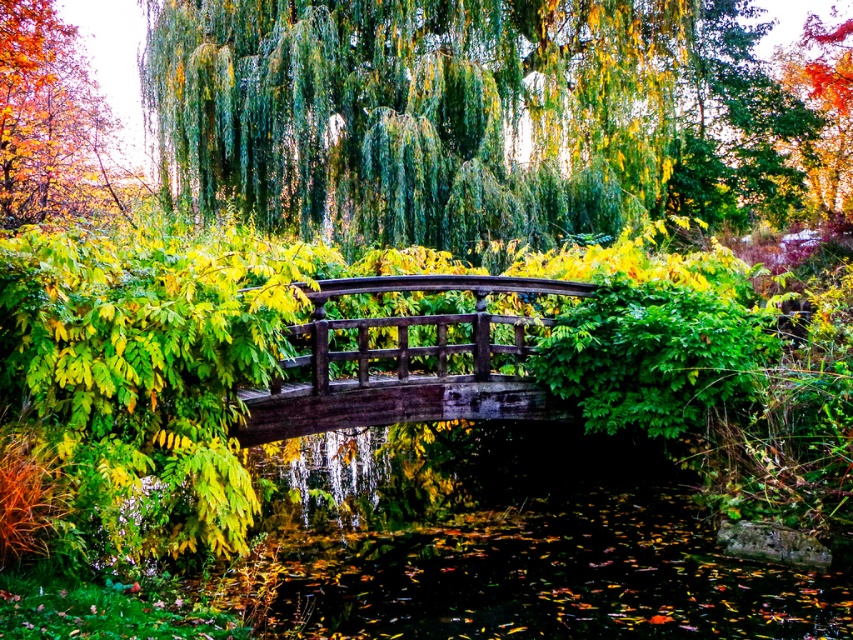
Does point (311, 376) lie behind point (82, 88)?

No, (311, 376) is closer to viewer.

Does point (273, 413) lie in front of point (0, 20)?

Yes, it is in front of point (0, 20).

Is point (260, 394) less distant than point (9, 116)?

Yes, it is.

Where is `wooden bridge at center`? This screenshot has height=640, width=853. wooden bridge at center is located at coordinates (405, 360).

Does green leafy tree at center have a smaller size compared to wooden bridge at center?

Actually, green leafy tree at center might be larger than wooden bridge at center.

Who is more distant from viewer, (357,225) or (351,400)?

The point (357,225) is more distant.

The image size is (853, 640). I want to click on green leafy tree at center, so click(x=415, y=113).

Between point (181, 196) and point (7, 168), which one is positioned behind?

The point (7, 168) is more distant.

Is green leafy tree at center to the left of autumn leaves at upper left from the viewer's perspective?

No, green leafy tree at center is not to the left of autumn leaves at upper left.

Who is more distant from viewer, (558,184) or (85,70)?

Point (85,70)

Locate an element on the screen. Image resolution: width=853 pixels, height=640 pixels. green leafy tree at center is located at coordinates (415, 113).